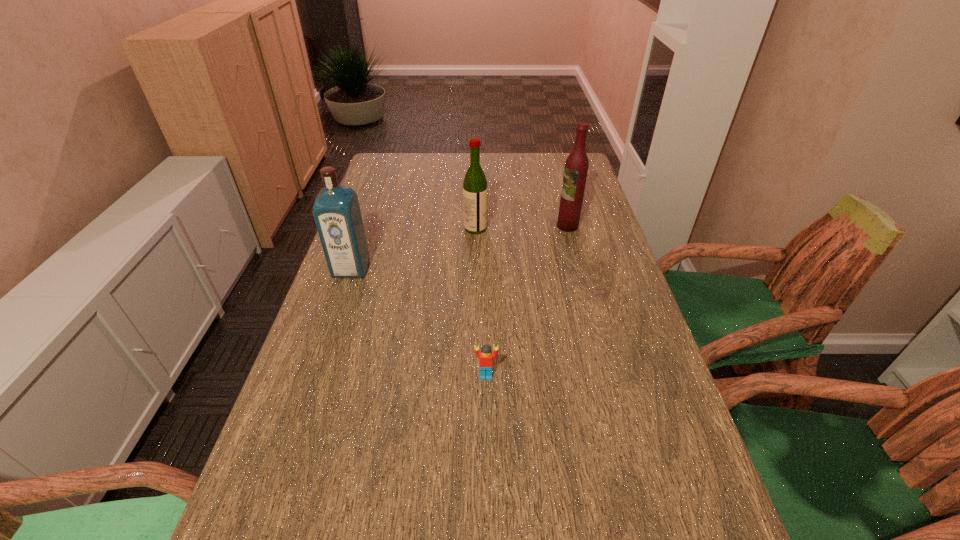
This screenshot has height=540, width=960. I want to click on free location located on the label of the second liquor from left to right, so click(x=568, y=228).

This screenshot has height=540, width=960. I want to click on vacant space located 0.240m on the face of the nearest object, so click(x=488, y=496).

You are a GUI agent. You are given a task and a screenshot of the screen. Output one action in this format:
    pyautogui.click(x=<x>, y=<y>)
    Task: Click on the object that is at the left edge
    
    Given the screenshot: What is the action you would take?
    pyautogui.click(x=336, y=210)

At what (x,y) coordinates should I click in order to perform the action: click on object at the right edge. Please return your answer as a coordinate pair (x, y). Looking at the image, I should click on (576, 166).

The width and height of the screenshot is (960, 540). What are the coordinates of `vacant area at the far edge of the desktop` in the screenshot? It's located at (433, 166).

The width and height of the screenshot is (960, 540). In the image, there is a desktop. In order to click on vacant space at the left edge in this screenshot , I will do `click(302, 424)`.

In the image, there is a desktop. Where is `vacant space at the right edge`? Image resolution: width=960 pixels, height=540 pixels. vacant space at the right edge is located at coordinates (572, 294).

Where is `empty location between the rightmost object and the nearest object`? empty location between the rightmost object and the nearest object is located at coordinates (527, 301).

You are a GUI agent. You are given a task and a screenshot of the screen. Output one action in this format:
    pyautogui.click(x=<x>, y=<y>)
    Task: Click on the blank region between the second liquor from left to right and the third farthest object
    The width and height of the screenshot is (960, 540).
    Given the screenshot: What is the action you would take?
    pyautogui.click(x=414, y=248)

You are a GUI agent. You are given a task and a screenshot of the screen. Output one action in this format:
    pyautogui.click(x=<x>, y=<y>)
    Task: Click on the empty location between the rightmost liquor and the nearest liquor
    The width and height of the screenshot is (960, 540).
    Given the screenshot: What is the action you would take?
    pyautogui.click(x=460, y=247)